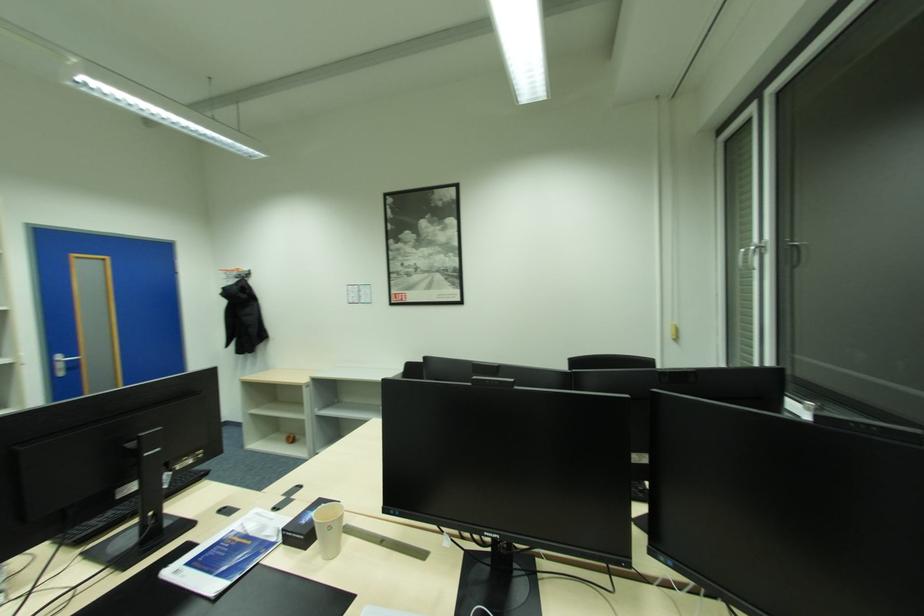
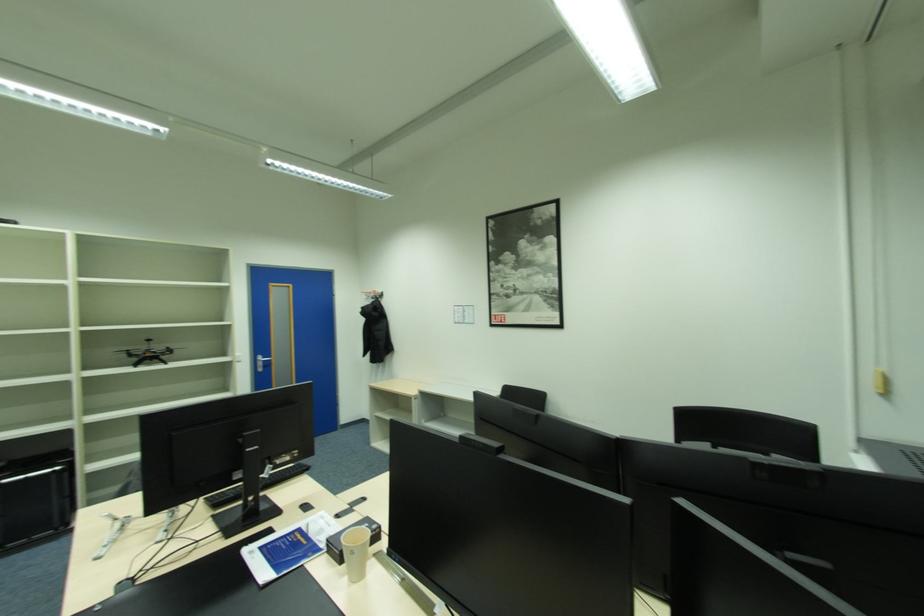
Question: Based on the continuous images, in which direction is the camera rotating? Reply with the corresponding letter.

Choices:
 (A) Left
 (B) Right
 (C) Up
 (D) Down

Answer: (A)